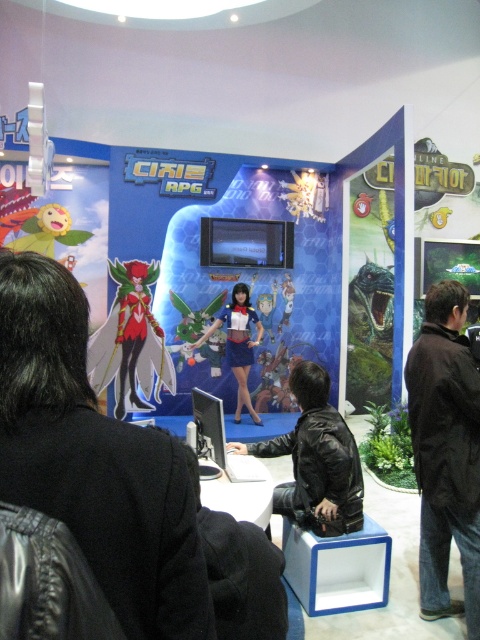
You are a game developer attending a convention and standing in front of the Digimon RPG booth. You notice two items at the center of the booth. Which item is positioned closer to you, the black leather jacket at center or the satin blue dress at center?

The black leather jacket at center is closer to the viewer than the satin blue dress at center.

You are a costume designer working on a Digimon RPG movie. You need to choose between the black leather jacket at center and the satin blue dress at center for a character who requires a more streamlined outfit. Which one would you recommend based on their thickness?

The black leather jacket at center is thinner than the satin blue dress at center, so I recommend the black leather jacket at center for a more streamlined outfit.

You are a game developer attending a convention and notice two items at the center of the Digimon RPG booth. The shiny metallic figure at center and the satin blue dress at center. Which one is more to the left?

The shiny metallic figure at center is positioned on the left side of the satin blue dress at center, so it is more to the left.